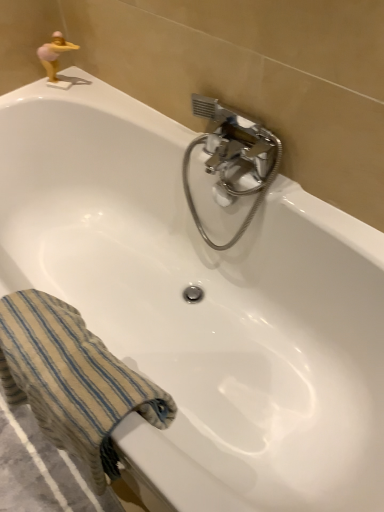
Question: From the image's perspective, would you say chrome metallic faucet at upper center is shown under beige striped towel at lower left?

Choices:
 (A) yes
 (B) no

Answer: (B)

Question: From a real-world perspective, is chrome metallic faucet at upper center located beneath beige striped towel at lower left?

Choices:
 (A) no
 (B) yes

Answer: (A)

Question: Is chrome metallic faucet at upper center shorter than beige striped towel at lower left?

Choices:
 (A) yes
 (B) no

Answer: (B)

Question: Is beige striped towel at lower left at the back of chrome metallic faucet at upper center?

Choices:
 (A) no
 (B) yes

Answer: (A)

Question: Can you confirm if chrome metallic faucet at upper center is wider than beige striped towel at lower left?

Choices:
 (A) no
 (B) yes

Answer: (A)

Question: Is beige striped towel at lower left taller or shorter than gold plastic figurine at upper left?

Choices:
 (A) tall
 (B) short

Answer: (A)

Question: In the image, is beige striped towel at lower left positioned in front of or behind gold plastic figurine at upper left?

Choices:
 (A) behind
 (B) front

Answer: (B)

Question: Is beige striped towel at lower left spatially inside gold plastic figurine at upper left, or outside of it?

Choices:
 (A) inside
 (B) outside

Answer: (B)

Question: From a real-world perspective, is beige striped towel at lower left positioned above or below gold plastic figurine at upper left?

Choices:
 (A) above
 (B) below

Answer: (B)

Question: In terms of height, does gold plastic figurine at upper left look taller or shorter compared to beige striped towel at lower left?

Choices:
 (A) short
 (B) tall

Answer: (A)

Question: In the image, is gold plastic figurine at upper left positioned in front of or behind beige striped towel at lower left?

Choices:
 (A) front
 (B) behind

Answer: (B)

Question: Based on their sizes in the image, would you say gold plastic figurine at upper left is bigger or smaller than beige striped towel at lower left?

Choices:
 (A) small
 (B) big

Answer: (A)

Question: From a real-world perspective, is gold plastic figurine at upper left positioned above or below beige striped towel at lower left?

Choices:
 (A) below
 (B) above

Answer: (B)

Question: In terms of width, does gold plastic figurine at upper left look wider or thinner when compared to chrome metallic faucet at upper center?

Choices:
 (A) thin
 (B) wide

Answer: (A)

Question: Relative to chrome metallic faucet at upper center, is gold plastic figurine at upper left in front or behind?

Choices:
 (A) front
 (B) behind

Answer: (B)